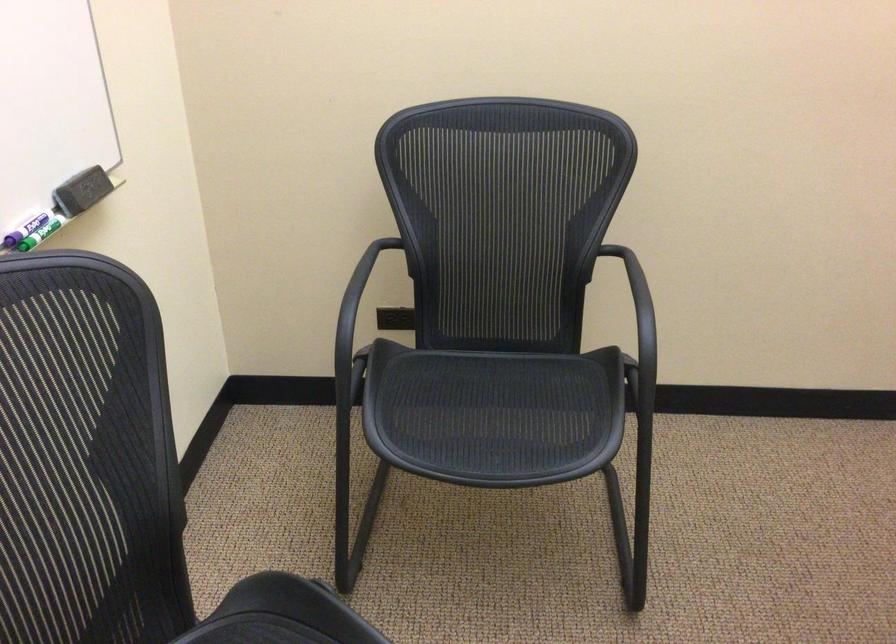
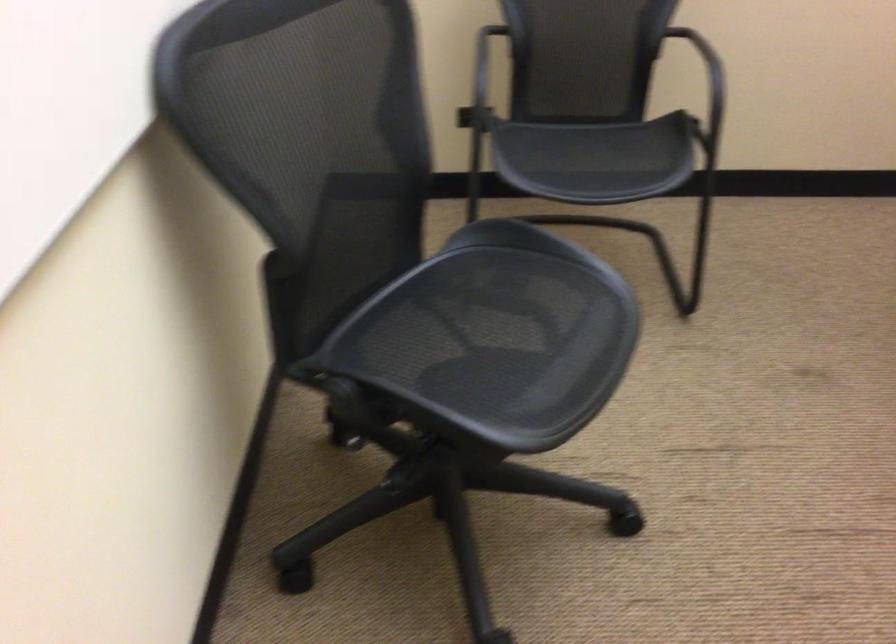
Question: The first image is from the beginning of the video and the second image is from the end. How did the camera likely rotate when shooting the video?

Choices:
 (A) Left
 (B) Right
 (C) Up
 (D) Down

Answer: (D)